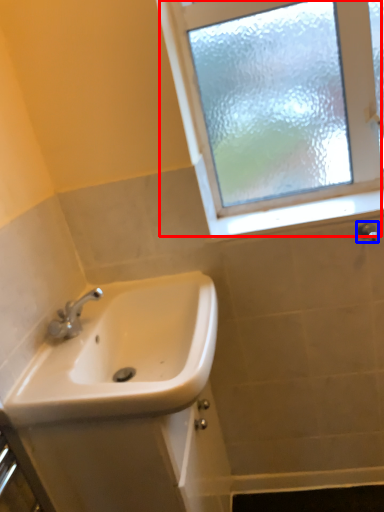
Question: Which object is further to the camera taking this photo, window (highlighted by a red box) or shower (highlighted by a blue box)?

Choices:
 (A) window
 (B) shower

Answer: (B)